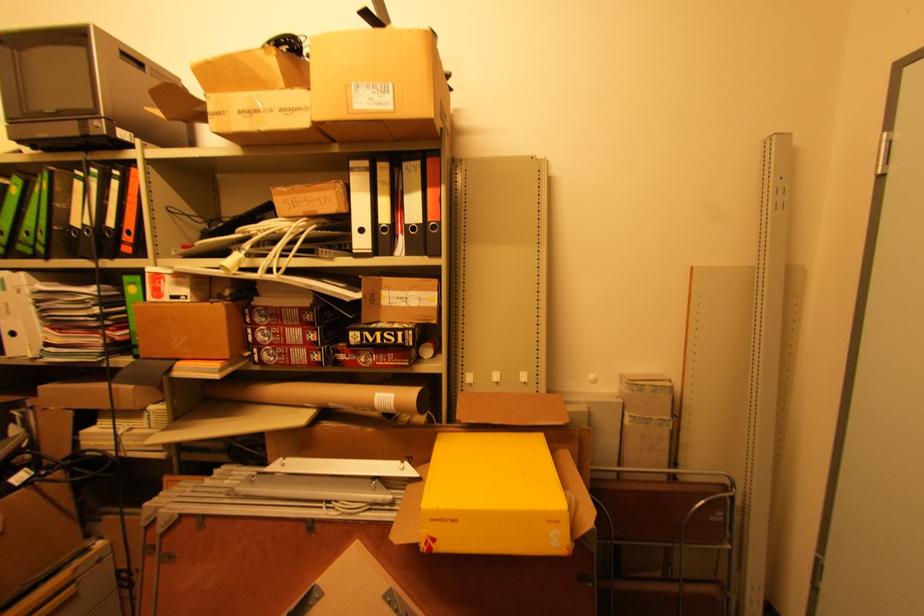
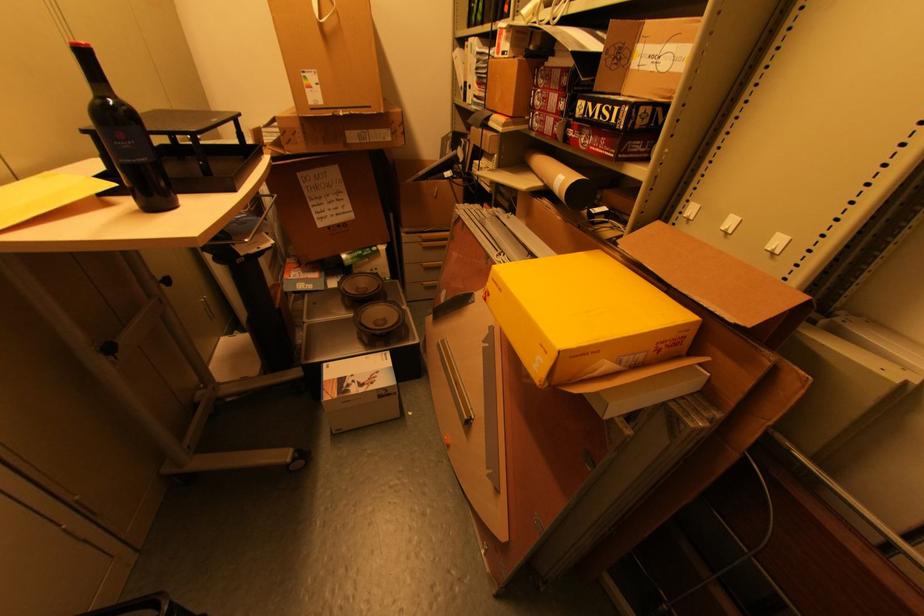
Where in the second image is the point corresponding to point 532,424 from the first image?

(688, 294)